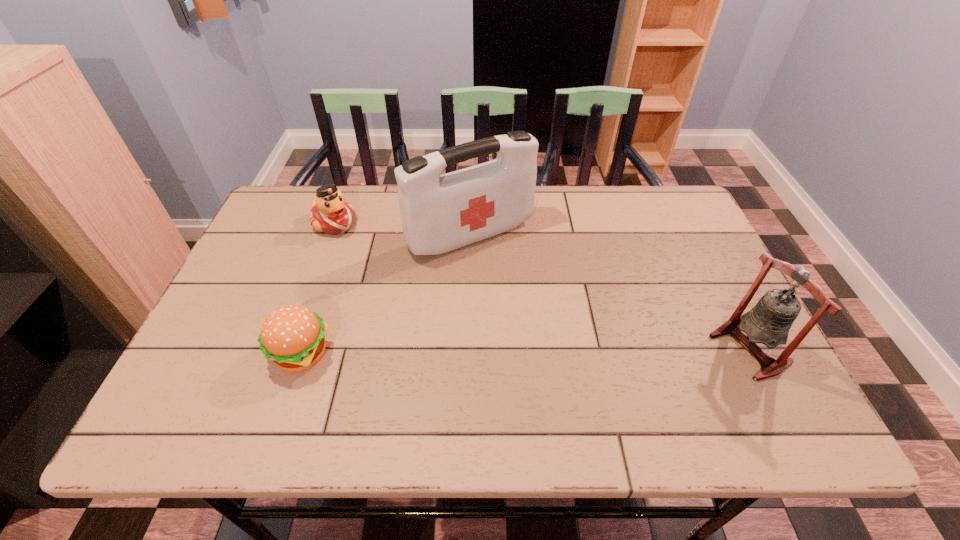
Identify the location of free spot located 0.310m on the face of the duck. (416, 290).

Identify the location of vacant space located on the face of the duck. The image size is (960, 540). (382, 262).

The height and width of the screenshot is (540, 960). I want to click on the first-aid kit present at the far edge, so click(x=439, y=213).

Where is `duck that is positioned at the far edge`? Image resolution: width=960 pixels, height=540 pixels. duck that is positioned at the far edge is located at coordinates (330, 213).

This screenshot has height=540, width=960. Identify the location of hamburger at the near edge. (292, 336).

Identify the location of bell that is at the near edge. (769, 321).

Locate an element on the screen. object at the left edge is located at coordinates (330, 213).

Find the location of `object present at the right edge`. object present at the right edge is located at coordinates (769, 321).

The height and width of the screenshot is (540, 960). What are the coordinates of `object located in the far left corner section of the desktop` in the screenshot? It's located at (330, 213).

I want to click on object that is at the near right corner, so click(x=769, y=321).